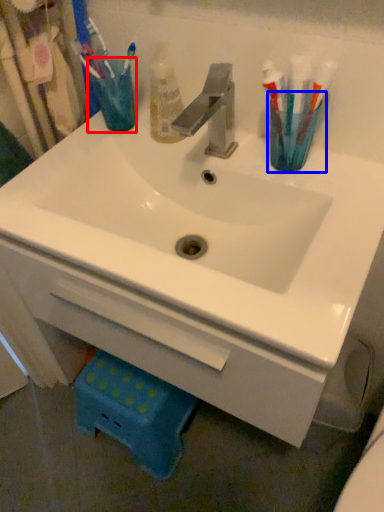
Question: Which of the following is the closest to the observer, turquoise (highlighted by a red box) or turquoise (highlighted by a blue box)?

Choices:
 (A) turquoise
 (B) turquoise

Answer: (B)